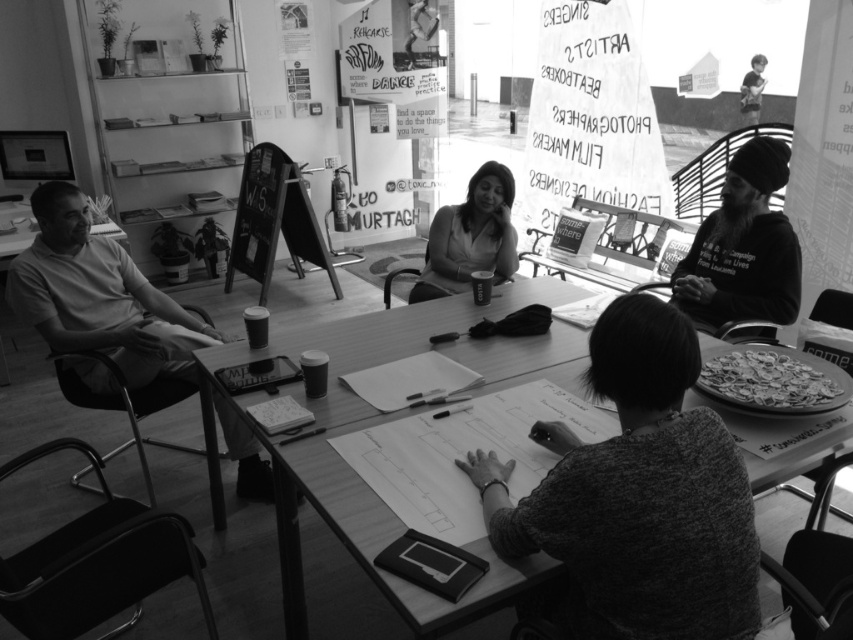
Can you confirm if smooth black shirt at center is positioned to the right of crusty pizza at lower right?

No, smooth black shirt at center is not to the right of crusty pizza at lower right.

Does point (437, 273) come behind point (822, 369)?

Yes, point (437, 273) is behind point (822, 369).

Consider the image. Measure the distance between point (500, 227) and camera.

The distance of point (500, 227) from camera is 3.26 meters.

Find the location of a particular element. The height and width of the screenshot is (640, 853). smooth black shirt at center is located at coordinates (469, 236).

Can you confirm if smooth white shirt at left is positioned to the right of smooth black shirt at center?

Incorrect, smooth white shirt at left is not on the right side of smooth black shirt at center.

Which is behind, point (186, 337) or point (485, 179)?

Point (485, 179)

Measure the distance between point [71,317] and camera.

Point [71,317] and camera are 8.80 feet apart.

Where is `smooth white shirt at left`? smooth white shirt at left is located at coordinates (99, 294).

Is point (772, 371) positioned behind point (253, 273)?

No.

Who is more forward, (706, 371) or (297, 259)?

Positioned in front is point (706, 371).

Who is more forward, (x=767, y=410) or (x=252, y=248)?

Point (x=767, y=410) is in front.

Identify the location of crusty pizza at lower right. (772, 380).